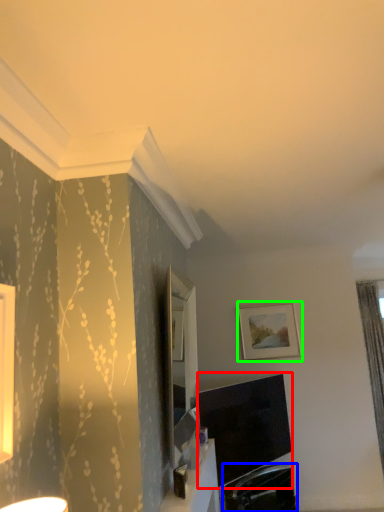
Question: Which object is the closest to the television (highlighted by a red box)? Choose among these: swivel chair (highlighted by a blue box) or picture frame (highlighted by a green box).

Choices:
 (A) swivel chair
 (B) picture frame

Answer: (A)